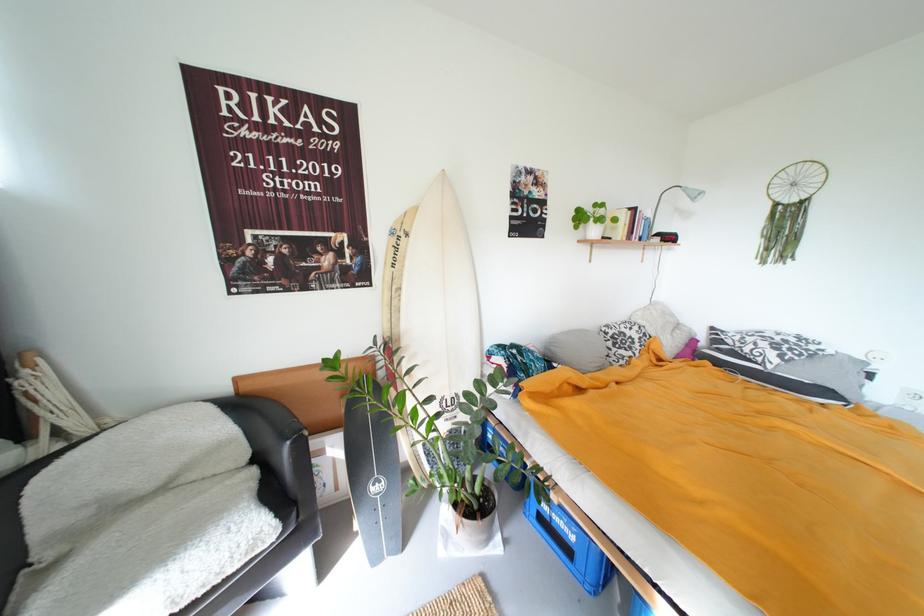
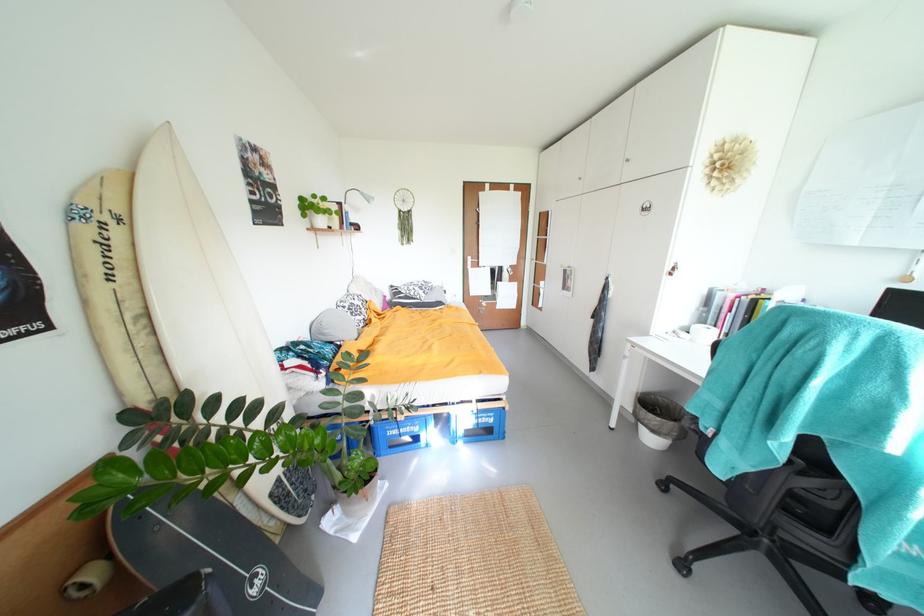
The point at (693, 192) is marked in the first image. Where is the corresponding point in the second image?

(370, 196)